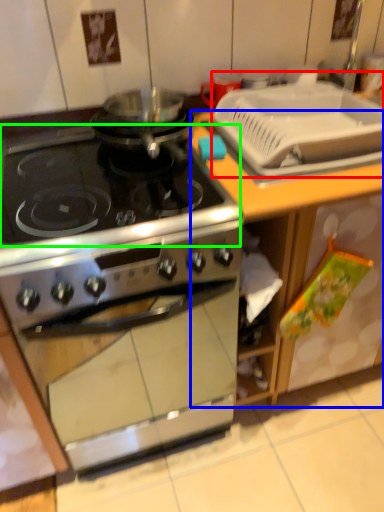
Question: Estimate the real-world distances between objects in this image. Which object is farther from sink (highlighted by a red box), counter (highlighted by a blue box) or gas stove (highlighted by a green box)?

Choices:
 (A) counter
 (B) gas stove

Answer: (B)